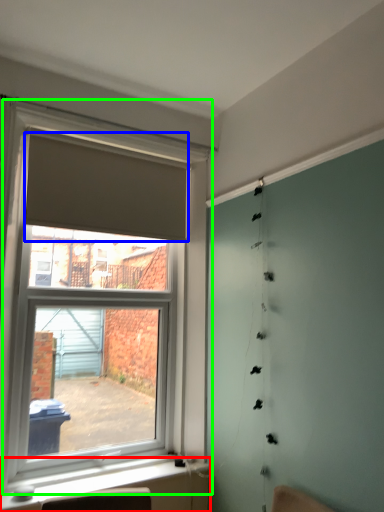
Question: Which is nearer to the window sill (highlighted by a red box)? curtain (highlighted by a blue box) or window (highlighted by a green box).

Choices:
 (A) curtain
 (B) window

Answer: (B)